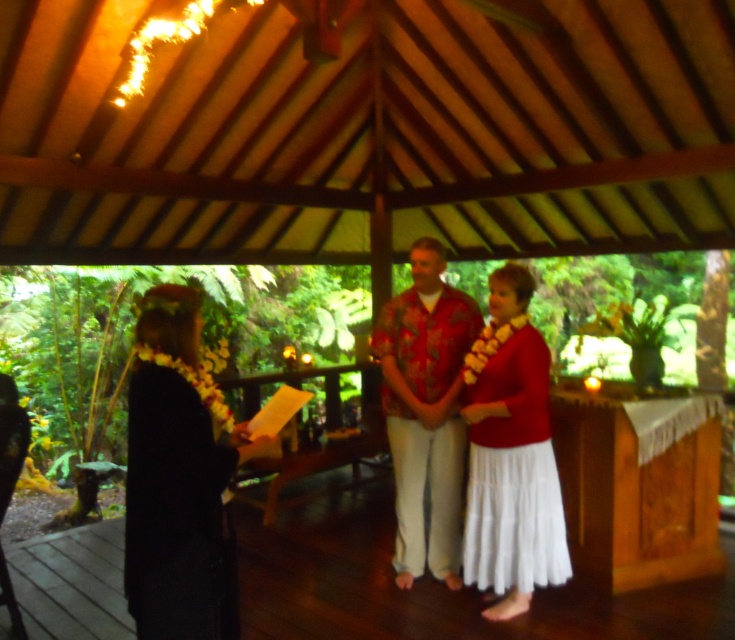
Can you confirm if white cotton skirt at center is thinner than hawaiian print shirt at center?

Correct, white cotton skirt at center's width is less than hawaiian print shirt at center's.

Does white cotton skirt at center have a greater width compared to hawaiian print shirt at center?

No.

What do you see at coordinates (509, 456) in the screenshot? I see `white cotton skirt at center` at bounding box center [509, 456].

You are a GUI agent. You are given a task and a screenshot of the screen. Output one action in this format:
    pyautogui.click(x=<x>, y=<y>)
    Task: Click on the white cotton skirt at center
    The width and height of the screenshot is (735, 640).
    Given the screenshot: What is the action you would take?
    pyautogui.click(x=509, y=456)

Does black fabric dress at left appear under hawaiian print shirt at center?

Indeed, black fabric dress at left is positioned under hawaiian print shirt at center.

Which is in front, point (198, 412) or point (404, 524)?

Point (198, 412)

Does point (129, 404) come in front of point (434, 259)?

Yes, it is in front of point (434, 259).

What are the coordinates of `black fabric dress at left` in the screenshot? It's located at (179, 477).

Who is more distant from viewer, (215, 486) or (473, 484)?

The point (473, 484) is more distant.

Between point (222, 520) and point (523, 454), which one is positioned behind?

Point (523, 454)

This screenshot has height=640, width=735. I want to click on black fabric dress at left, so click(179, 477).